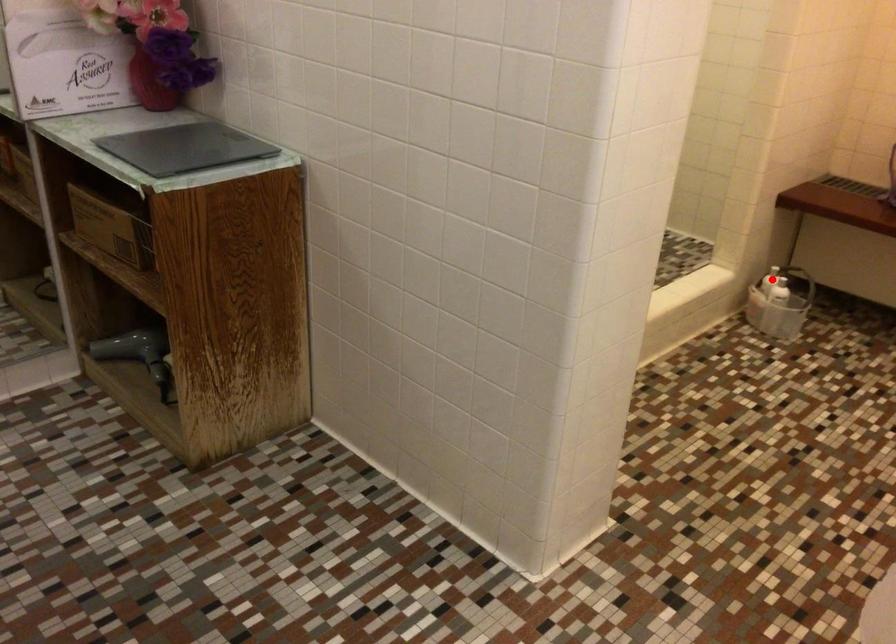
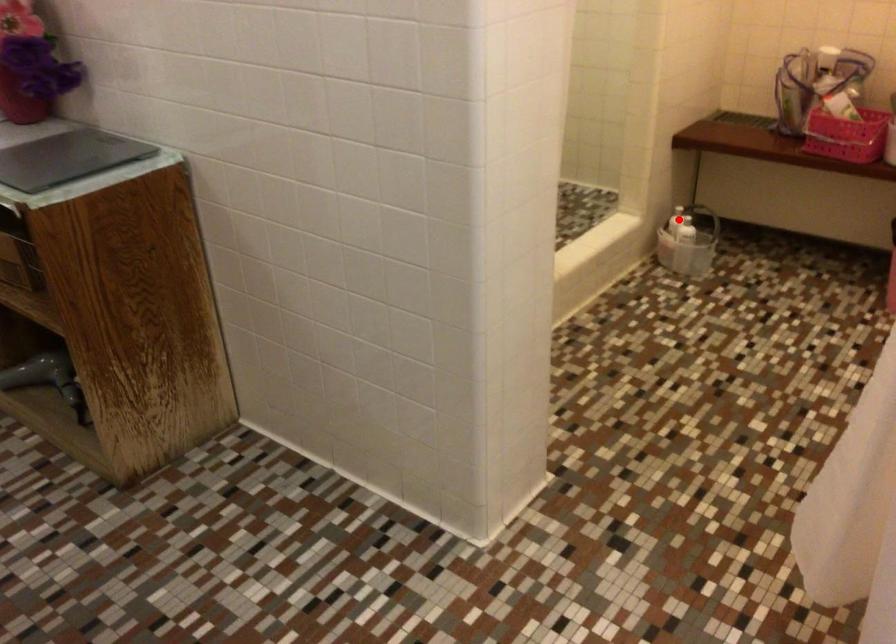
I am providing you with two images of the same scene from different viewpoints. A red point is marked on the first image and another point is marked on the second image. Does the point marked in image1 correspond to the same location as the one in image2?

Yes